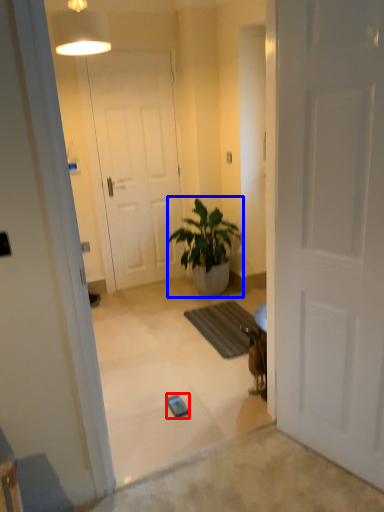
Question: Which of the following is the closest to the observer, mobile phone (highlighted by a red box) or houseplant (highlighted by a blue box)?

Choices:
 (A) mobile phone
 (B) houseplant

Answer: (A)